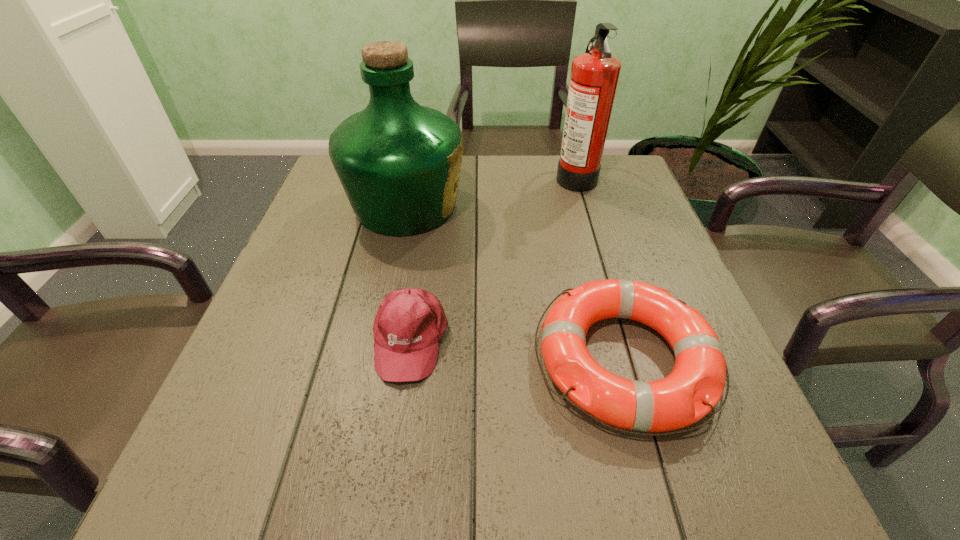
Locate an element on the screen. Image resolution: width=960 pixels, height=540 pixels. free location that satisfies the following two spatial constraints: 1. on the label side of the liquor; 2. on the right side of the shortest object is located at coordinates 373,360.